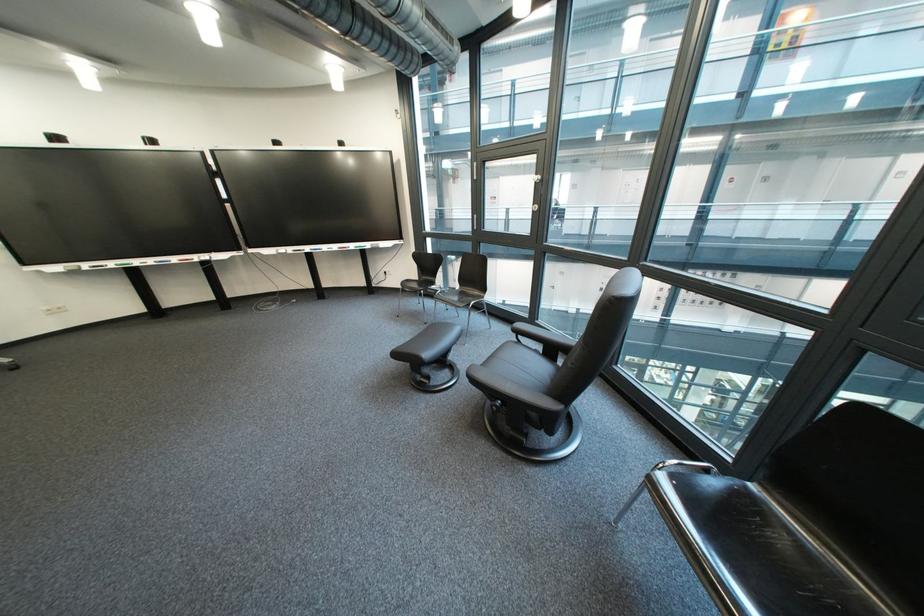
Describe the element at coordinates (521, 365) in the screenshot. The width and height of the screenshot is (924, 616). I see `the black leather sitting surface` at that location.